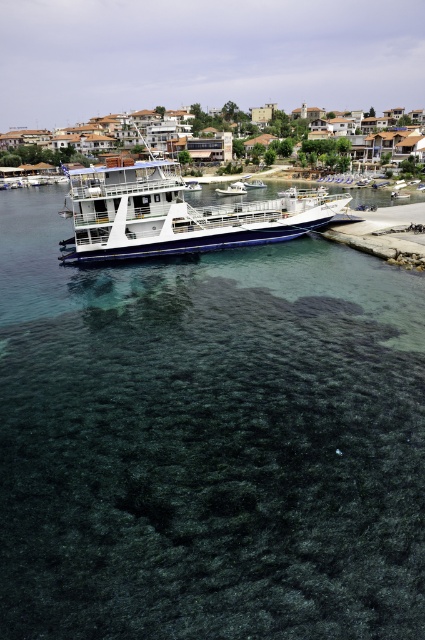
Question: Where is clear glass water at center located in relation to white glossy cruise ship at center in the image?

Choices:
 (A) below
 (B) above

Answer: (A)

Question: Is white glossy cruise ship at center to the right of white glossy boat at center from the viewer's perspective?

Choices:
 (A) no
 (B) yes

Answer: (B)

Question: Which object appears closest to the camera in this image?

Choices:
 (A) white glossy boat at center
 (B) clear glass water at center
 (C) white glossy cruise ship at center

Answer: (B)

Question: Does clear glass water at center have a greater width compared to white glossy cruise ship at center?

Choices:
 (A) no
 (B) yes

Answer: (A)

Question: Which point is farther from the camera taking this photo?

Choices:
 (A) (192, 589)
 (B) (217, 236)
 (C) (232, 182)

Answer: (C)

Question: Which object is positioned closest to the white glossy cruise ship at center?

Choices:
 (A) clear glass water at center
 (B) white glossy boat at center

Answer: (A)